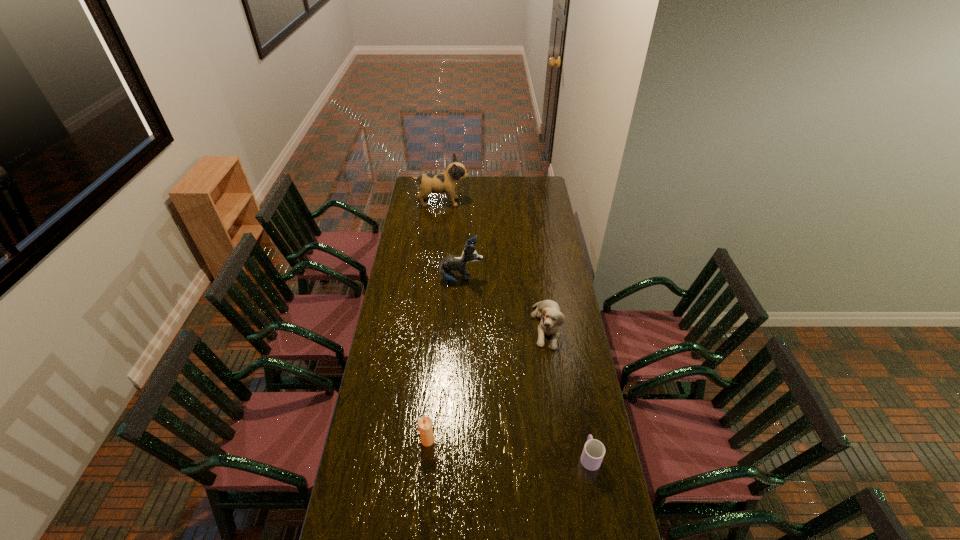
The height and width of the screenshot is (540, 960). Find the location of `free space located on the back of the candle`. free space located on the back of the candle is located at coordinates (432, 392).

Locate an element on the screen. The image size is (960, 540). vacant space located on the front-facing side of the nearest puppy is located at coordinates (557, 397).

This screenshot has width=960, height=540. I want to click on vacant space located 0.400m with the handle on the side of the cup, so click(571, 355).

Where is `vacant space located with the handle on the side of the cup`? This screenshot has height=540, width=960. vacant space located with the handle on the side of the cup is located at coordinates click(x=574, y=372).

Find the location of `vacant space located 0.310m with the handle on the side of the cup`. vacant space located 0.310m with the handle on the side of the cup is located at coordinates (574, 372).

At what (x,y) coordinates should I click in order to perform the action: click on object present at the far edge. Please return your answer as a coordinate pair (x, y). This screenshot has height=540, width=960. Looking at the image, I should click on (446, 182).

At what (x,y) coordinates should I click in order to perform the action: click on object located in the left edge section of the desktop. Please return your answer as a coordinate pair (x, y). Looking at the image, I should click on (446, 182).

The image size is (960, 540). In order to click on puppy that is at the right edge in this screenshot , I will do `click(549, 312)`.

Where is `cup positioned at the right edge`? This screenshot has width=960, height=540. cup positioned at the right edge is located at coordinates (593, 452).

Find the location of a particular element. object present at the far left corner is located at coordinates (446, 182).